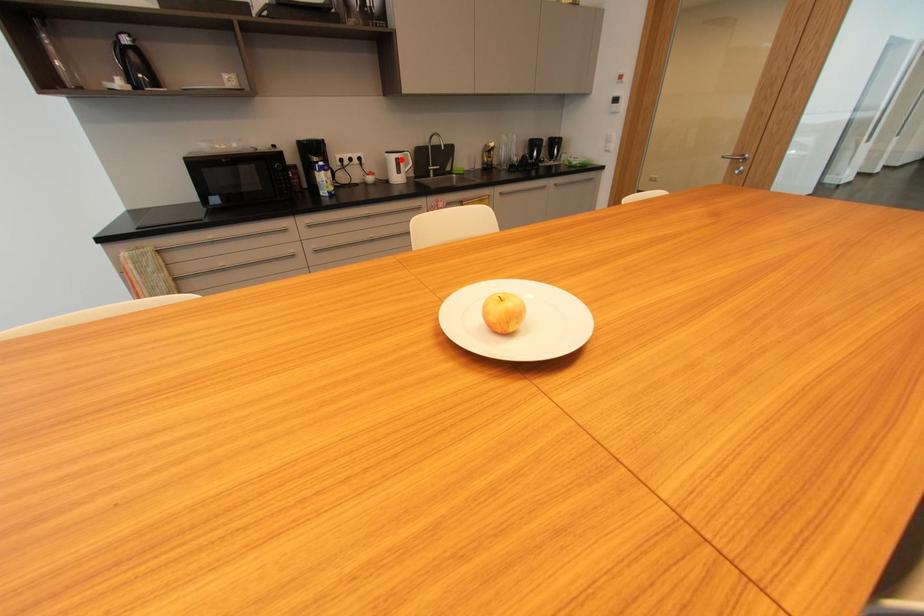
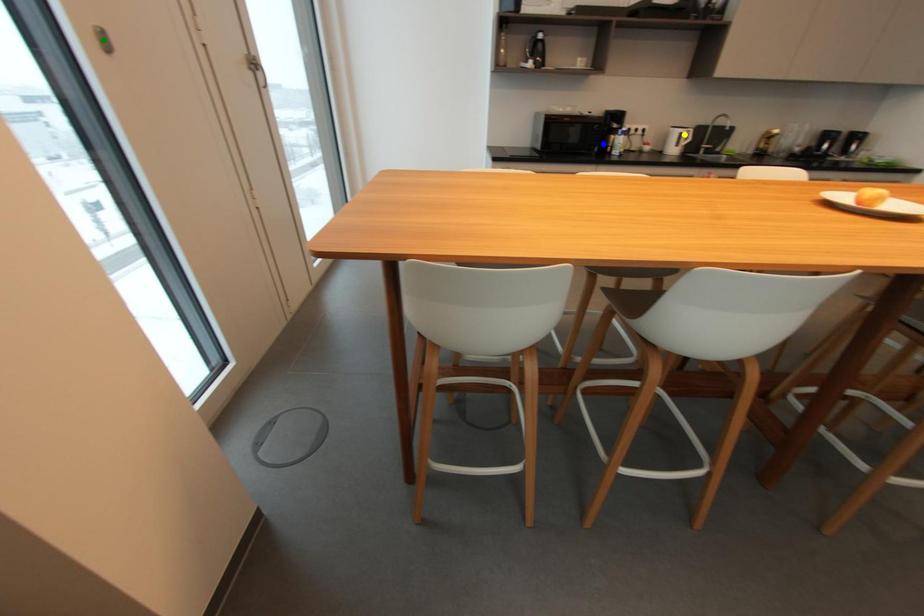
Question: I am providing you with two images of the same scene from different viewpoints. A red point is marked on the first image. You are given multiple points on the second image. In image 2, which mark is for the same physical point as the one in image 1?

Choices:
 (A) green point
 (B) blue point
 (C) yellow point

Answer: (C)